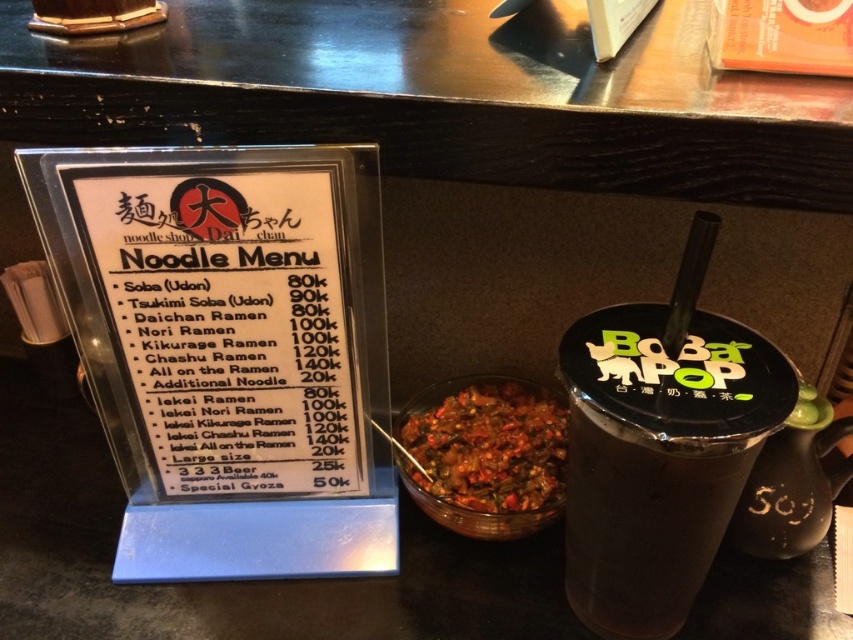
Question: Which object appears farthest from the camera in this image?

Choices:
 (A) chili pepper sauce at center
 (B) dark brown smooth cup at right
 (C) white plastic menu at center

Answer: (A)

Question: Can you confirm if dark brown smooth cup at right is bigger than chili pepper sauce at center?

Choices:
 (A) yes
 (B) no

Answer: (A)

Question: Among these points, which one is farthest from the camera?

Choices:
 (A) (556, 356)
 (B) (94, 248)

Answer: (A)

Question: Can you confirm if dark brown smooth cup at right is positioned to the right of chili pepper sauce at center?

Choices:
 (A) yes
 (B) no

Answer: (A)

Question: Is dark brown smooth cup at right to the left of chili pepper sauce at center from the viewer's perspective?

Choices:
 (A) no
 (B) yes

Answer: (A)

Question: Which of the following is the closest to the observer?

Choices:
 (A) (363, 442)
 (B) (534, 438)

Answer: (A)